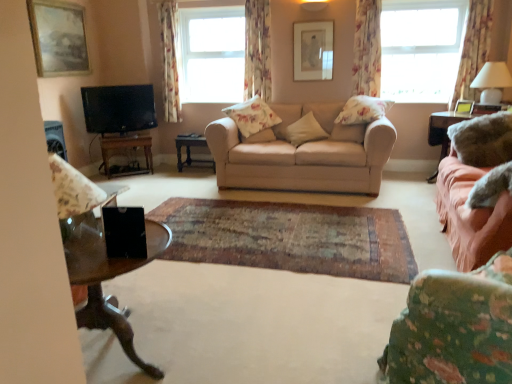
You are a GUI agent. You are given a task and a screenshot of the screen. Output one action in this format:
    pyautogui.click(x=<x>, y=<y>)
    Task: Click on the vacant area that lies between transparent glass coffee table at lower left and rug at center
    The image size is (512, 384).
    Given the screenshot: What is the action you would take?
    pyautogui.click(x=251, y=302)